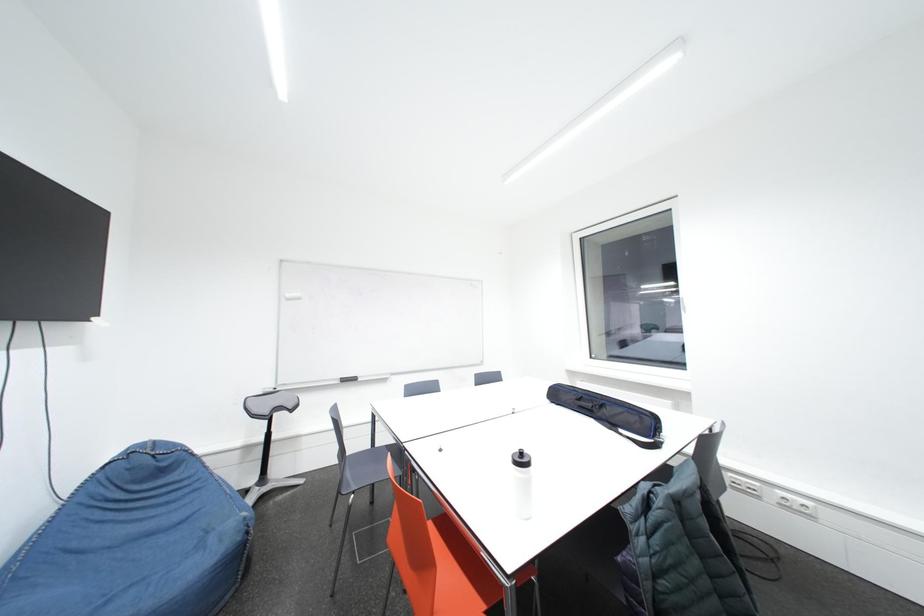
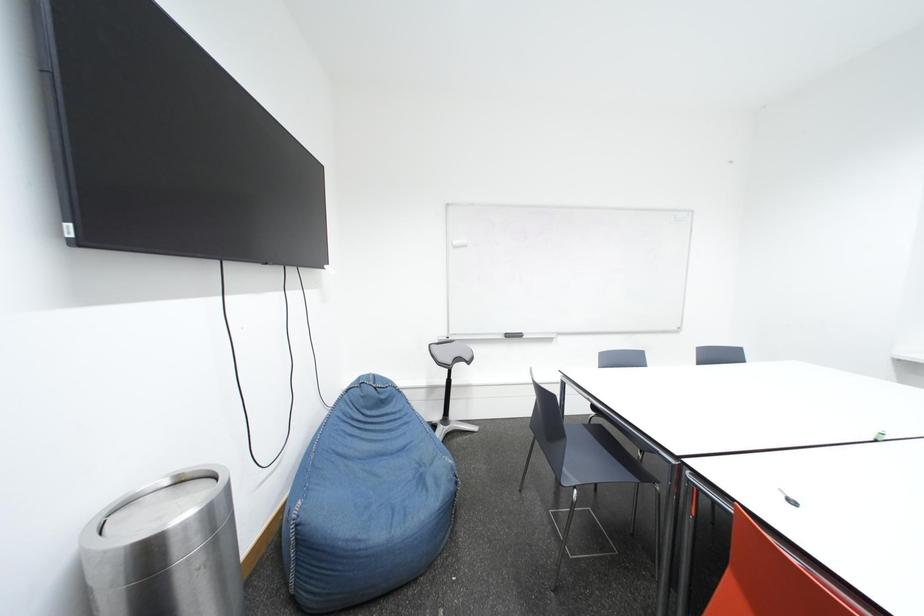
What movement of the cameraman would produce the second image?

The movement direction of the cameraman is left, forward.